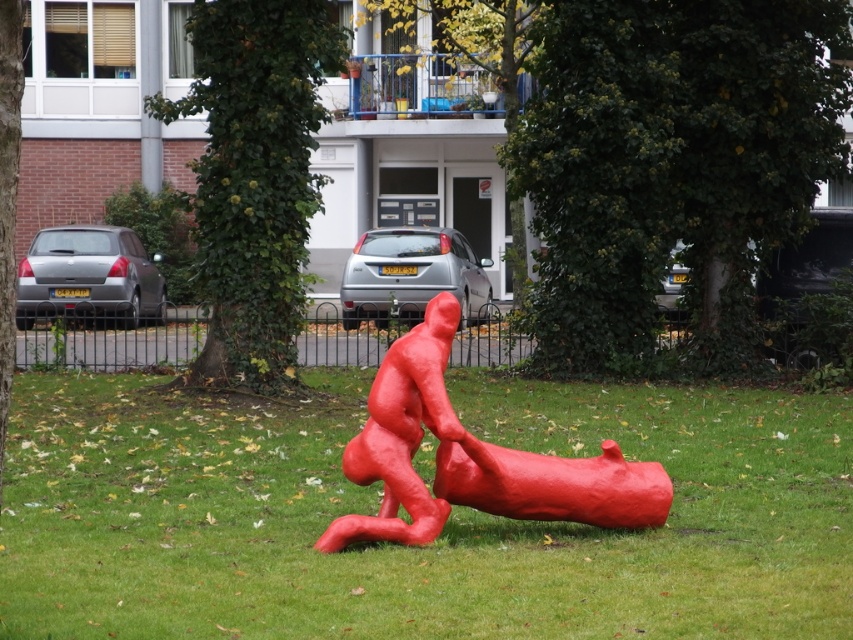
Question: Which point is farther to the camera?

Choices:
 (A) green grass at center
 (B) matte red figure at center

Answer: (B)

Question: Is green grass at center positioned behind matte red figure at center?

Choices:
 (A) yes
 (B) no

Answer: (B)

Question: Observing the image, what is the correct spatial positioning of green grass at center in reference to matte red figure at center?

Choices:
 (A) left
 (B) right

Answer: (A)

Question: Does green grass at center come behind matte red figure at center?

Choices:
 (A) no
 (B) yes

Answer: (A)

Question: Which point is farther to the camera?

Choices:
 (A) matte red figure at center
 (B) green grass at center

Answer: (A)